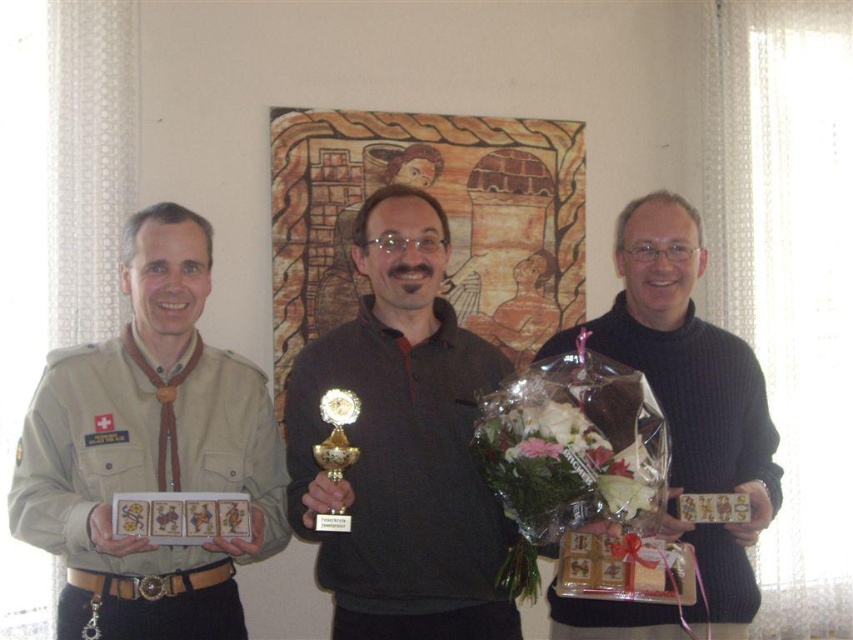
Consider the image. You are standing at point (165, 396) and want to walk to point (653, 468). Is the path clear? Please explain using the scene description.

The path between point (653, 468) and point (165, 396) is clear because point (653, 468) is in front of point (165, 396), indicating they are along the same line of sight without obstructions.

Based on the photo, you are standing in the room where the three men are. You want to place a 5.5 feet long banner between you and the point at coordinates point [141,480]. Will the banner fit without overlapping anything?

The distance between you and the point at coordinates point [141,480] is 5.82 feet, so the 5.5 feet long banner will fit without overlapping anything as it is shorter than the available space.

Based on the scene description, where is the beige uniform at left located in terms of its 2D coordinates?

The beige uniform at left is located at the 2D coordinates of point (149, 449).